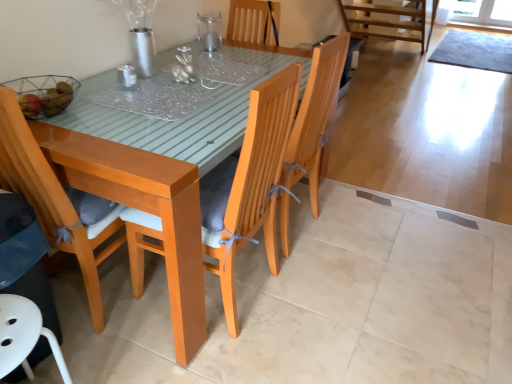
Image resolution: width=512 pixels, height=384 pixels. I want to click on metallic silver candlestick at center, placed as the second tableware when sorted from back to front, so click(127, 77).

What is the approximate width of white plastic chair at lower left, placed as the first chair when sorted from left to right?

white plastic chair at lower left, placed as the first chair when sorted from left to right, is 12.17 inches in width.

I want to click on white plastic chair at lower left, which ranks as the third chair in right-to-left order, so click(x=24, y=336).

What do you see at coordinates (249, 185) in the screenshot? This screenshot has width=512, height=384. I see `wooden chair at center, marked as the first chair in a right-to-left arrangement` at bounding box center [249, 185].

You are a GUI agent. You are given a task and a screenshot of the screen. Output one action in this format:
    pyautogui.click(x=<x>, y=<y>)
    Task: Click on the matte wood chair at left, placed as the 2th chair when sorted from left to right
    This screenshot has height=384, width=512.
    Given the screenshot: What is the action you would take?
    pyautogui.click(x=57, y=201)

Does wooden swivel chair at lower left have a greater height compared to metallic silver candlestick at center, acting as the first tableware starting from the left?

Indeed, wooden swivel chair at lower left has a greater height compared to metallic silver candlestick at center, acting as the first tableware starting from the left.

Between wooden swivel chair at lower left and metallic silver candlestick at center, positioned as the second tableware in right-to-left order, which one has larger size?

wooden swivel chair at lower left.

Which is in front, point (45, 246) or point (126, 78)?

The point (45, 246) is closer to the camera.

From a real-world perspective, which is physically below, wooden swivel chair at lower left or metallic silver candlestick at center, which is the 1th tableware in front-to-back order?

In real-world perspective, wooden swivel chair at lower left is lower.

Is point (42, 159) positioned in front of point (1, 342)?

No, it is not.

Looking at this image, could you tell me if matte wood chair at left, placed as the 2th chair when sorted from left to right, is facing white plastic chair at lower left, which ranks as the third chair in right-to-left order?

No, matte wood chair at left, placed as the 2th chair when sorted from left to right, is not turned towards white plastic chair at lower left, which ranks as the third chair in right-to-left order.

Which object is further away from the camera, matte wood chair at left, positioned as the 2th chair in right-to-left order, or white plastic chair at lower left, which ranks as the third chair in right-to-left order?

matte wood chair at left, positioned as the 2th chair in right-to-left order, is more distant.

From the image's perspective, is matte wood chair at left, placed as the 2th chair when sorted from left to right, located above or below white plastic chair at lower left, which ranks as the third chair in right-to-left order?

Clearly, from the image's perspective, matte wood chair at left, placed as the 2th chair when sorted from left to right, is above white plastic chair at lower left, which ranks as the third chair in right-to-left order.

Considering their positions, is metallic silver candlestick at center, placed as the second tableware when sorted from back to front, located in front of or behind wooden chair at center, marked as the first chair in a right-to-left arrangement?

Visually, metallic silver candlestick at center, placed as the second tableware when sorted from back to front, is located behind wooden chair at center, marked as the first chair in a right-to-left arrangement.

Consider the image. Which of these two, metallic silver candlestick at center, acting as the first tableware starting from the left, or wooden chair at center, marked as the first chair in a right-to-left arrangement, is bigger?

wooden chair at center, marked as the first chair in a right-to-left arrangement.

Do you think metallic silver candlestick at center, placed as the second tableware when sorted from back to front, is within wooden chair at center, the third chair positioned from the left, or outside of it?

metallic silver candlestick at center, placed as the second tableware when sorted from back to front, lies outside wooden chair at center, the third chair positioned from the left.

Is metallic silver candlestick at center, acting as the first tableware starting from the left, looking in the opposite direction of wooden chair at center, marked as the first chair in a right-to-left arrangement?

metallic silver candlestick at center, acting as the first tableware starting from the left, is not turned away from wooden chair at center, marked as the first chair in a right-to-left arrangement.

From the image's perspective, is clear glass vase at upper center, the 2th tableware when ordered from left to right, located above or below metallic silver candlestick at center, which is the 1th tableware in front-to-back order?

Clearly, from the image's perspective, clear glass vase at upper center, the 2th tableware when ordered from left to right, is above metallic silver candlestick at center, which is the 1th tableware in front-to-back order.

Which is closer, (205, 53) or (130, 77)?

Point (205, 53) appears to be farther away from the viewer than point (130, 77).

Considering the relative sizes of clear glass vase at upper center, the 2th tableware when ordered from left to right, and metallic silver candlestick at center, which is the 1th tableware in front-to-back order, in the image provided, is clear glass vase at upper center, the 2th tableware when ordered from left to right, shorter than metallic silver candlestick at center, which is the 1th tableware in front-to-back order,?

No, clear glass vase at upper center, the 2th tableware when ordered from left to right, is not shorter than metallic silver candlestick at center, which is the 1th tableware in front-to-back order.

Can you tell me how much white plastic chair at lower left, which ranks as the third chair in right-to-left order, and metallic silver candlestick at center, acting as the first tableware starting from the left, differ in facing direction?

1.79 degrees.

From the picture: Is white plastic chair at lower left, which ranks as the third chair in right-to-left order, far from metallic silver candlestick at center, which is the 1th tableware in front-to-back order?

No, white plastic chair at lower left, which ranks as the third chair in right-to-left order, is in close proximity to metallic silver candlestick at center, which is the 1th tableware in front-to-back order.

Considering the sizes of objects white plastic chair at lower left, placed as the first chair when sorted from left to right, and metallic silver candlestick at center, which is the 1th tableware in front-to-back order, in the image provided, who is wider, white plastic chair at lower left, placed as the first chair when sorted from left to right, or metallic silver candlestick at center, which is the 1th tableware in front-to-back order,?

With larger width is white plastic chair at lower left, placed as the first chair when sorted from left to right.

From a real-world perspective, does white plastic chair at lower left, placed as the first chair when sorted from left to right, sit lower than metallic silver candlestick at center, which is the 1th tableware in front-to-back order?

Indeed, from a real-world perspective, white plastic chair at lower left, placed as the first chair when sorted from left to right, is positioned beneath metallic silver candlestick at center, which is the 1th tableware in front-to-back order.

Which of these two, white plastic chair at lower left, placed as the first chair when sorted from left to right, or clear glass vase at upper center, which appears as the first tableware when viewed from the right, stands shorter?

clear glass vase at upper center, which appears as the first tableware when viewed from the right, is shorter.

Are white plastic chair at lower left, placed as the first chair when sorted from left to right, and clear glass vase at upper center, acting as the second tableware starting from the bottom, located far from each other?

Indeed, white plastic chair at lower left, placed as the first chair when sorted from left to right, is not near clear glass vase at upper center, acting as the second tableware starting from the bottom.

Is white plastic chair at lower left, placed as the first chair when sorted from left to right, aimed at clear glass vase at upper center, the 1th tableware viewed from the top?

No, white plastic chair at lower left, placed as the first chair when sorted from left to right, does not turn towards clear glass vase at upper center, the 1th tableware viewed from the top.

Is white plastic chair at lower left, which ranks as the third chair in right-to-left order, thinner than clear glass vase at upper center, acting as the second tableware starting from the bottom?

No.

From a real-world perspective, which is physically below, wooden swivel chair at lower left or clear glass vase at upper center, acting as the second tableware starting from the bottom?

wooden swivel chair at lower left.

Does wooden swivel chair at lower left have a larger size compared to clear glass vase at upper center, which appears as the first tableware when viewed from the right?

Indeed, wooden swivel chair at lower left has a larger size compared to clear glass vase at upper center, which appears as the first tableware when viewed from the right.

Image resolution: width=512 pixels, height=384 pixels. Identify the location of tableware that is the 2nd one when counting rightward from the wooden swivel chair at lower left. (210, 33).

From a real-world perspective, which tableware is the 1st one above the wooden swivel chair at lower left? Please provide its 2D coordinates.

[(127, 77)]

Identify the location of chair that is the 2nd one when counting downward from the matte wood chair at left, positioned as the 2th chair in right-to-left order (from the image's perspective). The width and height of the screenshot is (512, 384). (24, 336).

Estimate the real-world distances between objects in this image. Which object is further from matte wood chair at left, placed as the 2th chair when sorted from left to right, metallic silver candlestick at center, which is the 1th tableware in front-to-back order, or wooden swivel chair at lower left?

metallic silver candlestick at center, which is the 1th tableware in front-to-back order, lies further to matte wood chair at left, placed as the 2th chair when sorted from left to right, than the other object.

From the picture: Which object lies further to the anchor point metallic silver candlestick at center, placed as the second tableware when sorted from back to front, white plastic chair at lower left, placed as the first chair when sorted from left to right, or clear glass vase at upper center, the first tableware positioned from the back?

white plastic chair at lower left, placed as the first chair when sorted from left to right, is positioned further to the anchor metallic silver candlestick at center, placed as the second tableware when sorted from back to front.

Estimate the real-world distances between objects in this image. Which object is further from clear glass vase at upper center, the 1th tableware viewed from the top, matte wood chair at left, placed as the 2th chair when sorted from left to right, or white plastic chair at lower left, placed as the first chair when sorted from left to right?

Based on the image, white plastic chair at lower left, placed as the first chair when sorted from left to right, appears to be further to clear glass vase at upper center, the 1th tableware viewed from the top.

Considering their positions, is wooden swivel chair at lower left positioned closer to matte wood chair at left, positioned as the 2th chair in right-to-left order, than white plastic chair at lower left, placed as the first chair when sorted from left to right?

wooden swivel chair at lower left lies closer to matte wood chair at left, positioned as the 2th chair in right-to-left order, than the other object.

When comparing their distances from clear glass vase at upper center, acting as the second tableware starting from the bottom, does white plastic chair at lower left, placed as the first chair when sorted from left to right, or metallic silver candlestick at center, acting as the first tableware starting from the left, seem further?

Based on the image, white plastic chair at lower left, placed as the first chair when sorted from left to right, appears to be further to clear glass vase at upper center, acting as the second tableware starting from the bottom.

From the image, which object appears to be nearer to wooden swivel chair at lower left, white plastic chair at lower left, placed as the first chair when sorted from left to right, or wooden chair at center, the third chair positioned from the left?

Based on the image, white plastic chair at lower left, placed as the first chair when sorted from left to right, appears to be nearer to wooden swivel chair at lower left.

Considering their positions, is white plastic chair at lower left, placed as the first chair when sorted from left to right, positioned closer to matte wood chair at left, placed as the 2th chair when sorted from left to right, than wooden chair at center, marked as the first chair in a right-to-left arrangement?

white plastic chair at lower left, placed as the first chair when sorted from left to right, lies closer to matte wood chair at left, placed as the 2th chair when sorted from left to right, than the other object.

Which object lies further to the anchor point metallic silver candlestick at center, the second tableware when ordered from top to bottom, white plastic chair at lower left, placed as the first chair when sorted from left to right, or wooden chair at center, the third chair positioned from the left?

white plastic chair at lower left, placed as the first chair when sorted from left to right, is positioned further to the anchor metallic silver candlestick at center, the second tableware when ordered from top to bottom.

The image size is (512, 384). I want to click on swivel chair between matte wood chair at left, positioned as the 2th chair in right-to-left order, and white plastic chair at lower left, which ranks as the third chair in right-to-left order, vertically, so click(x=25, y=258).

Identify the location of tableware between clear glass vase at upper center, which appears as the first tableware when viewed from the right, and wooden swivel chair at lower left from top to bottom. (127, 77).

In order to click on tableware between clear glass vase at upper center, acting as the second tableware starting from the bottom, and white plastic chair at lower left, which ranks as the third chair in right-to-left order, vertically in this screenshot , I will do `click(127, 77)`.

Image resolution: width=512 pixels, height=384 pixels. In order to click on swivel chair that lies between metallic silver candlestick at center, positioned as the second tableware in right-to-left order, and white plastic chair at lower left, placed as the first chair when sorted from left to right, from top to bottom in this screenshot , I will do `click(25, 258)`.